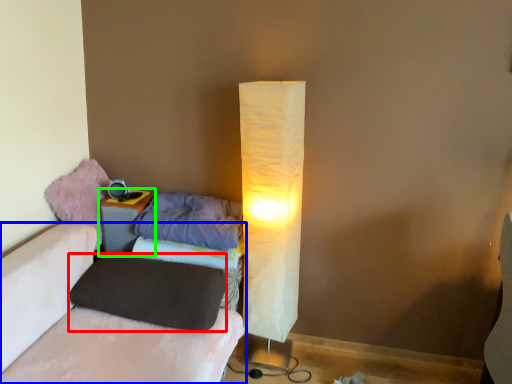
Question: Which object is the farthest from pillow (highlighted by a red box)? Choose among these: furniture (highlighted by a blue box) or nightstand (highlighted by a green box).

Choices:
 (A) furniture
 (B) nightstand

Answer: (B)